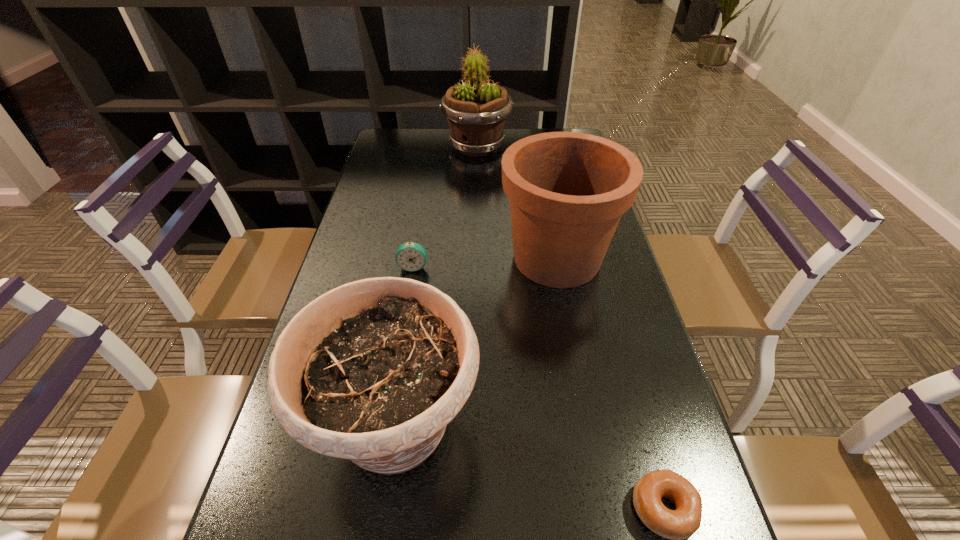
Where is `alarm clock at the left edge`? This screenshot has height=540, width=960. alarm clock at the left edge is located at coordinates (410, 256).

Locate an element on the screen. This screenshot has height=540, width=960. object situated at the right edge is located at coordinates (567, 191).

The width and height of the screenshot is (960, 540). What are the coordinates of `blank space at the far edge of the desktop` in the screenshot? It's located at (462, 155).

The height and width of the screenshot is (540, 960). In the image, there is a desktop. Find the location of `vacant space at the left edge`. vacant space at the left edge is located at coordinates (334, 267).

In order to click on vacant point at the right edge in this screenshot , I will do `click(655, 449)`.

Locate an element on the screen. This screenshot has width=960, height=540. free space at the far left corner of the desktop is located at coordinates (424, 130).

You are a GUI agent. You are given a task and a screenshot of the screen. Output one action in this format:
    pyautogui.click(x=<x>, y=<y>)
    Task: Click on the vacant space that is in between the farthest object and the fourth tallest object
    The height and width of the screenshot is (540, 960).
    Given the screenshot: What is the action you would take?
    pyautogui.click(x=445, y=206)

You are a GUI agent. You are given a task and a screenshot of the screen. Output one action in this format:
    pyautogui.click(x=<x>, y=<y>)
    Task: Click on the vacant area that lies between the alarm clock and the farthest flowerpot
    The height and width of the screenshot is (540, 960).
    Given the screenshot: What is the action you would take?
    pyautogui.click(x=445, y=206)

You are a GUI agent. You are given a task and a screenshot of the screen. Output one action in this format:
    pyautogui.click(x=<x>, y=<y>)
    Task: Click on the free space between the farthest object and the alarm clock
    
    Given the screenshot: What is the action you would take?
    pyautogui.click(x=445, y=206)

Locate an element on the screen. free spot between the alarm clock and the farthest flowerpot is located at coordinates (445, 206).